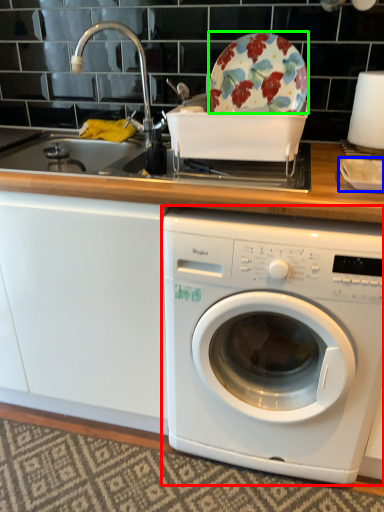
Question: Considering the real-world distances, which object is farthest from washing machine (highlighted by a red box)? tableware (highlighted by a blue box) or table (highlighted by a green box)?

Choices:
 (A) tableware
 (B) table

Answer: (B)